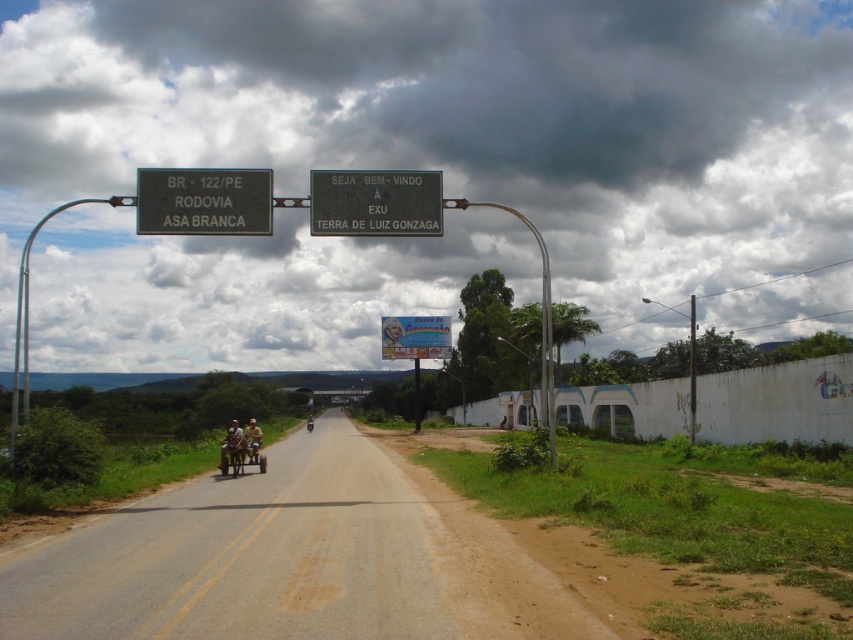
Who is positioned more to the right, brown dirt track at center or wooden cart at center?

From the viewer's perspective, brown dirt track at center appears more on the right side.

Does brown dirt track at center have a lesser height compared to wooden cart at center?

Incorrect, brown dirt track at center's height does not fall short of wooden cart at center's.

Locate an element on the screen. brown dirt track at center is located at coordinates (291, 560).

Where is `brown dirt track at center`? brown dirt track at center is located at coordinates (291, 560).

Between black metal sign at upper center and brown leather motorcycle at center, which one appears on the left side from the viewer's perspective?

Positioned to the left is brown leather motorcycle at center.

Which of these two, black metal sign at upper center or brown leather motorcycle at center, stands shorter?

Standing shorter between the two is brown leather motorcycle at center.

Who is more forward, [421,227] or [236,428]?

Point [421,227] is in front.

Where is `black metal sign at upper center`? The height and width of the screenshot is (640, 853). black metal sign at upper center is located at coordinates (375, 202).

Is point (161, 208) behind point (413, 321)?

No.

Is point (225, 168) less distant than point (387, 356)?

That is False.

This screenshot has width=853, height=640. What are the coordinates of `green metallic sign at upper center` in the screenshot? It's located at (204, 202).